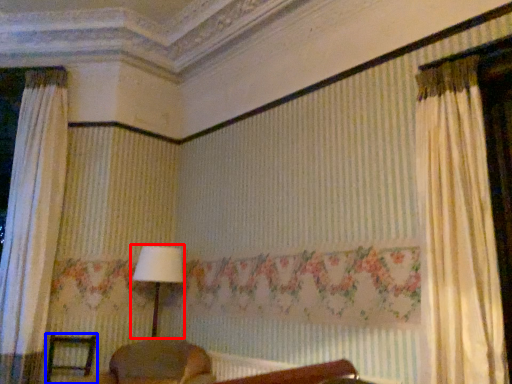
Question: Which of the following is the farthest to the observer, table lamp (highlighted by a red box) or furniture (highlighted by a blue box)?

Choices:
 (A) table lamp
 (B) furniture

Answer: (A)